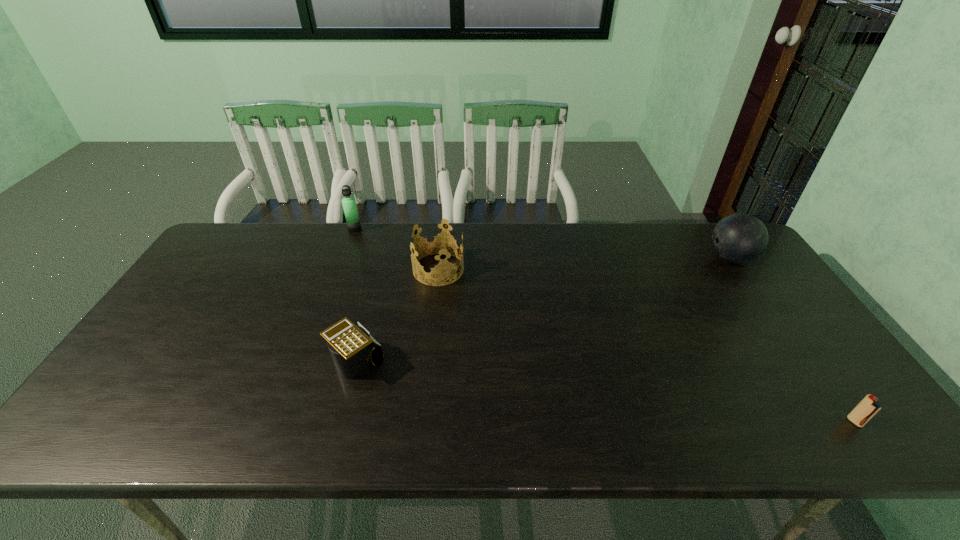
This screenshot has height=540, width=960. Find the location of `blank area located 0.280m on the grip area of the bowling ball`. blank area located 0.280m on the grip area of the bowling ball is located at coordinates (619, 258).

Locate an element on the screen. Image resolution: width=960 pixels, height=540 pixels. vacant space situated on the grip area of the bowling ball is located at coordinates click(681, 258).

Find the location of a particular element. This screenshot has height=540, width=960. blank space located on the back of the third object from left to right is located at coordinates (x=443, y=229).

This screenshot has height=540, width=960. I want to click on free spot located on the left of the fourth farthest object, so click(212, 363).

Where is `vacant space positioned 0.240m on the left of the igniter`? vacant space positioned 0.240m on the left of the igniter is located at coordinates (741, 422).

Identify the location of thermos bottle at the far edge. The width and height of the screenshot is (960, 540). 353,223.

Where is `bowling ball that is at the far edge`? The image size is (960, 540). bowling ball that is at the far edge is located at coordinates (739, 238).

This screenshot has height=540, width=960. I want to click on crown located at the far edge, so click(436, 245).

Where is `object that is positioned at the near edge`? This screenshot has width=960, height=540. object that is positioned at the near edge is located at coordinates click(x=868, y=407).

At what (x,y) coordinates should I click in order to perform the action: click on bowling ball at the right edge. Please return your answer as a coordinate pair (x, y). Looking at the image, I should click on point(739,238).